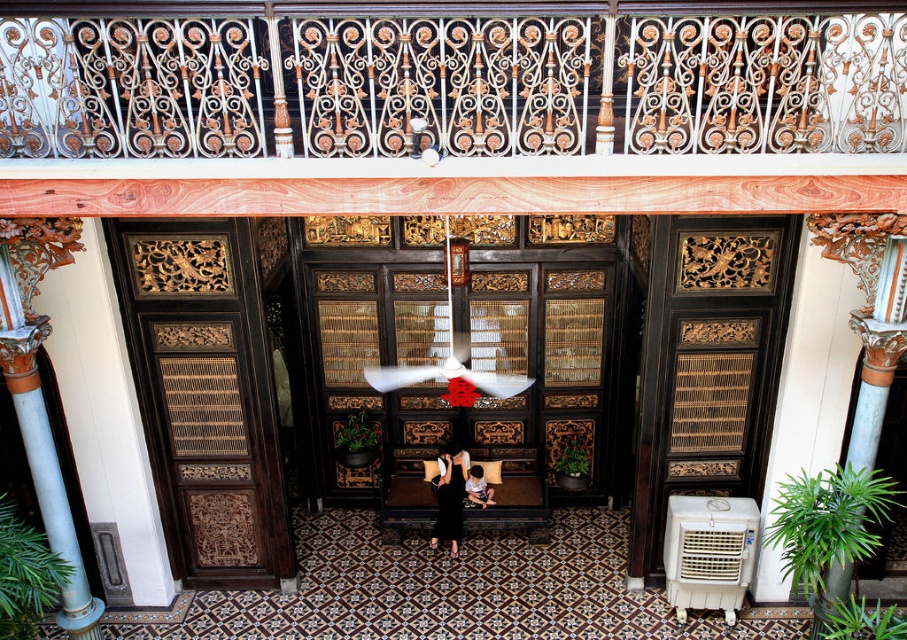
Question: Can you confirm if blue painted wood column at left is thinner than black matte dress at center?

Choices:
 (A) yes
 (B) no

Answer: (B)

Question: Does white wrought iron railing at upper center appear under dark brown leather chair at center?

Choices:
 (A) no
 (B) yes

Answer: (A)

Question: Which object is positioned farthest from the dark brown leather chair at center?

Choices:
 (A) white wrought iron railing at upper center
 (B) blue painted wood column at left

Answer: (A)

Question: Considering the relative positions of white wrought iron railing at upper center and dark brown leather chair at center in the image provided, where is white wrought iron railing at upper center located with respect to dark brown leather chair at center?

Choices:
 (A) left
 (B) right

Answer: (A)

Question: Which object is closer to the camera taking this photo?

Choices:
 (A) black matte dress at center
 (B) white wrought iron railing at upper center
 (C) blue painted wood column at left
 (D) dark brown leather chair at center

Answer: (B)

Question: Which point appears farthest from the camera in this image?

Choices:
 (A) (459, 531)
 (B) (488, 490)

Answer: (B)